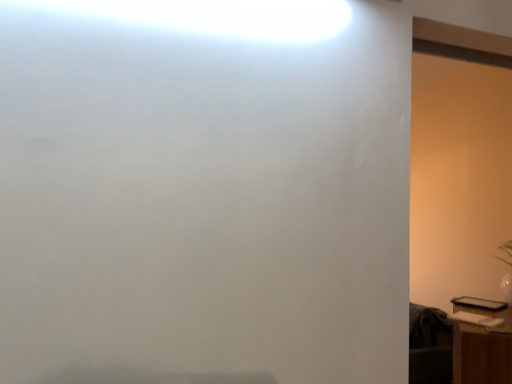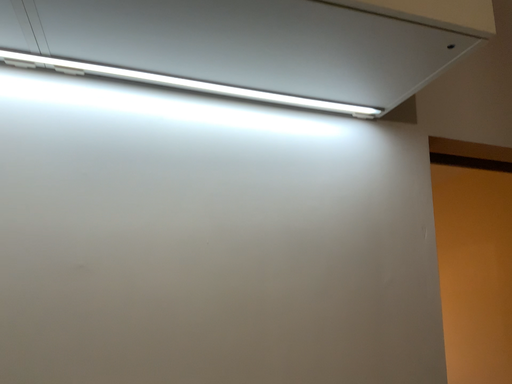
Question: Which way did the camera rotate in the video?

Choices:
 (A) rotated upward
 (B) rotated downward

Answer: (A)